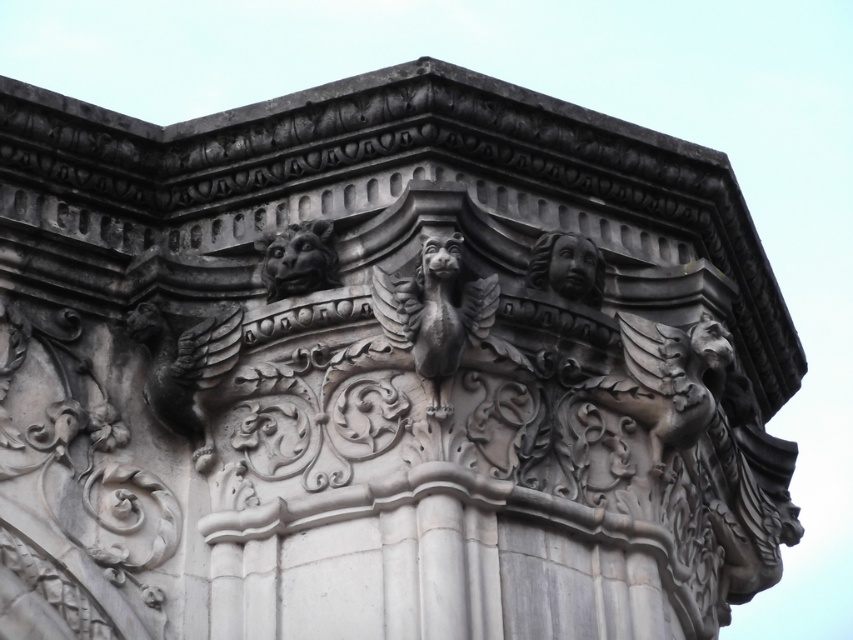
Question: Is matte stone lion at upper center to the right of polished stone face at upper right from the viewer's perspective?

Choices:
 (A) yes
 (B) no

Answer: (B)

Question: Does dark gray stone gargoyle at center appear over polished stone face at upper right?

Choices:
 (A) no
 (B) yes

Answer: (A)

Question: Considering the relative positions of matte stone lion at upper center and polished stone face at upper right in the image provided, where is matte stone lion at upper center located with respect to polished stone face at upper right?

Choices:
 (A) right
 (B) left

Answer: (B)

Question: Which point is farther to the camera?

Choices:
 (A) (274, 275)
 (B) (424, 298)
 (C) (537, 256)

Answer: (C)

Question: Which of the following is the closest to the observer?

Choices:
 (A) polished stone face at upper right
 (B) dark gray stone gargoyle at center

Answer: (B)

Question: Which object is positioned farthest from the dark gray stone gargoyle at center?

Choices:
 (A) matte stone lion at upper center
 (B) polished stone face at upper right

Answer: (B)